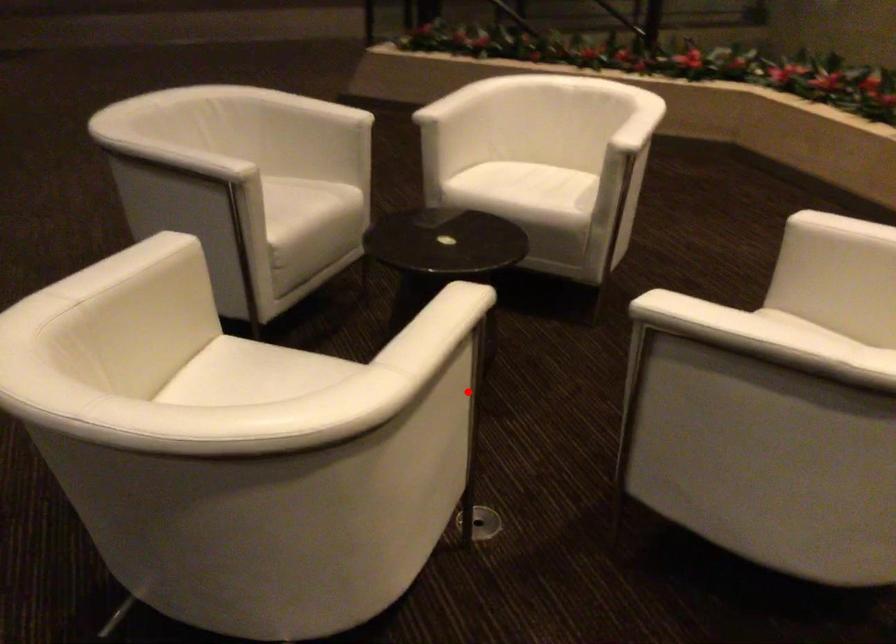
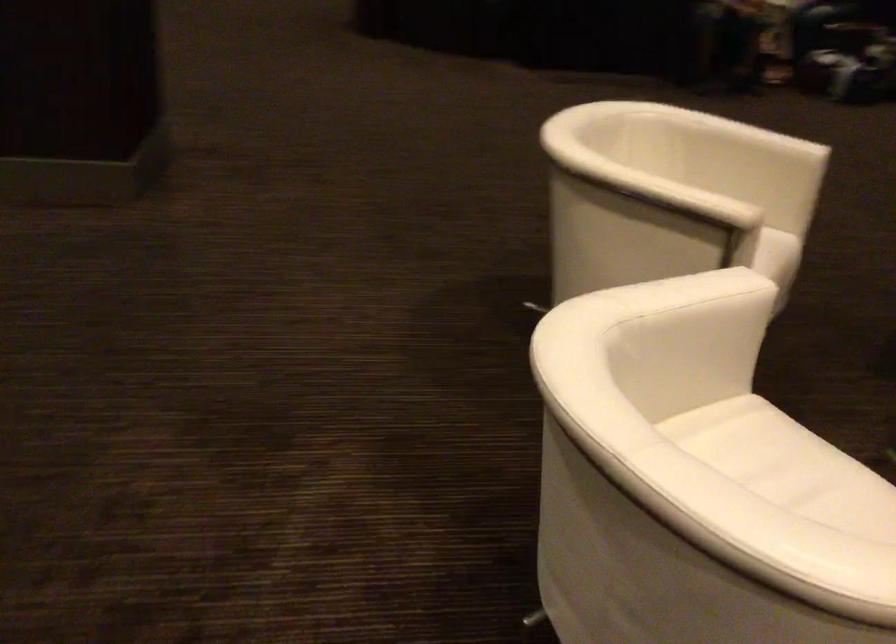
The point at the highlighted location is marked in the first image. Where is the corresponding point in the second image?

(676, 261)